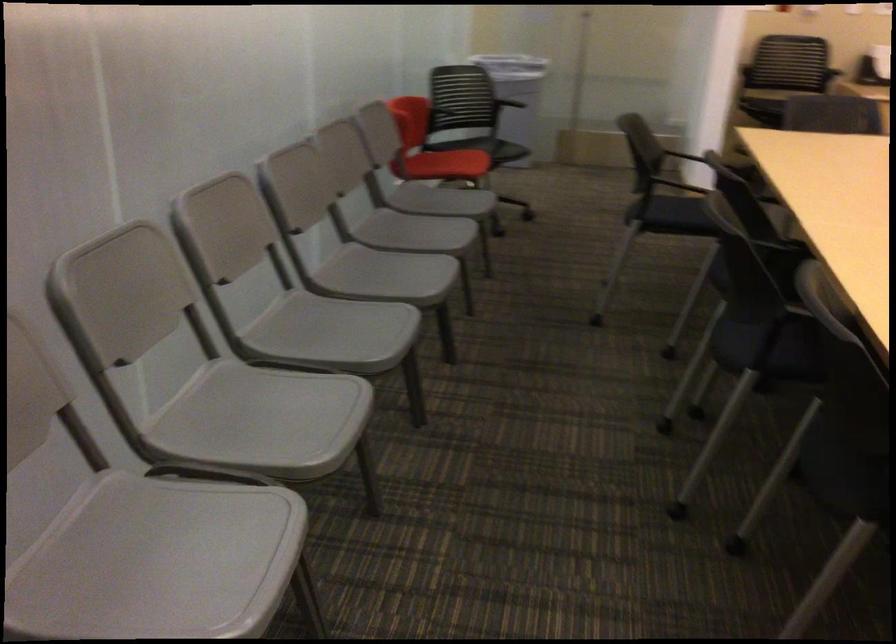
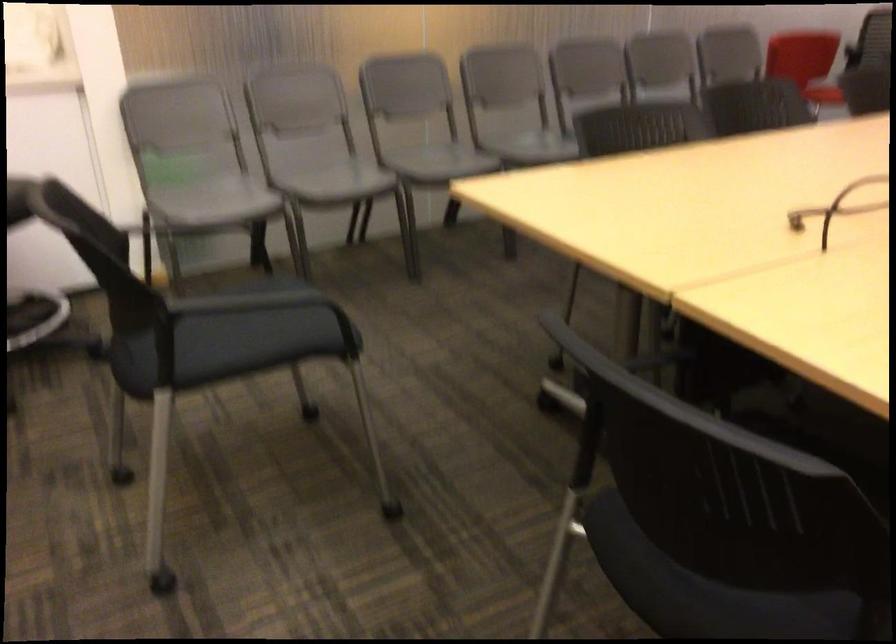
The point at [293,444] is marked in the first image. Where is the corresponding point in the second image?

(436, 161)